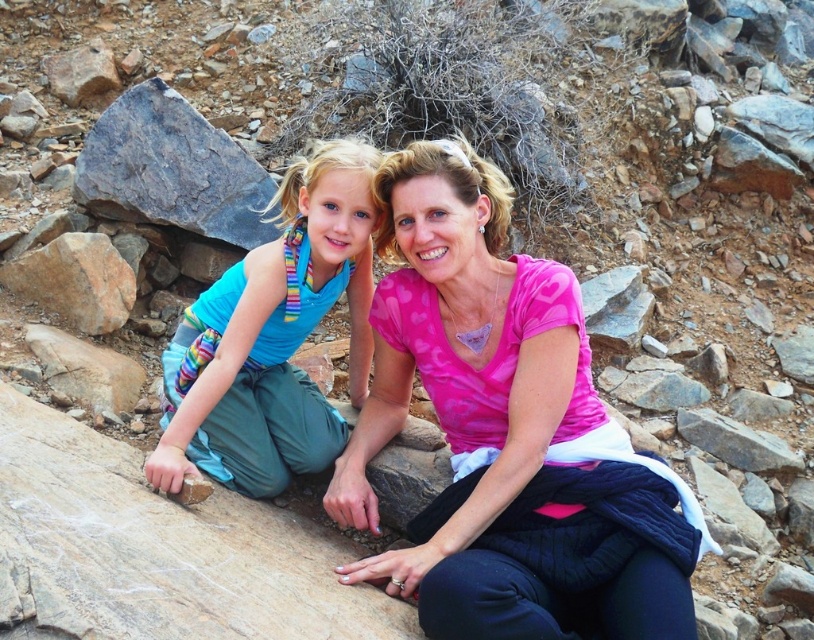
Measure the distance between point [611,621] and camera.

Point [611,621] and camera are 18.04 feet apart from each other.

You are a GUI agent. You are given a task and a screenshot of the screen. Output one action in this format:
    pyautogui.click(x=<x>, y=<y>)
    Task: Click on the pink fabric at center
    The height and width of the screenshot is (640, 814).
    Given the screenshot: What is the action you would take?
    pyautogui.click(x=506, y=433)

Is point (465, 360) less distant than point (228, 420)?

No, it is behind (228, 420).

You are a GUI agent. You are given a task and a screenshot of the screen. Output one action in this format:
    pyautogui.click(x=<x>, y=<y>)
    Task: Click on the pink fabric at center
    The height and width of the screenshot is (640, 814).
    Given the screenshot: What is the action you would take?
    pyautogui.click(x=506, y=433)

Which is in front, point (349, 451) or point (212, 234)?

Point (349, 451) is more forward.

Between point (559, 316) and point (160, 90), which one is positioned behind?

The point (160, 90) is behind.

At what (x,y) coordinates should I click in order to perform the action: click on pink fabric at center. Please return your answer as a coordinate pair (x, y). This screenshot has height=640, width=814. Looking at the image, I should click on (506, 433).

The width and height of the screenshot is (814, 640). I want to click on pink fabric at center, so click(506, 433).

Between blue fabric at center and gray rough boulder at upper left, which one appears on the left side from the viewer's perspective?

Positioned to the left is gray rough boulder at upper left.

You are a GUI agent. You are given a task and a screenshot of the screen. Output one action in this format:
    pyautogui.click(x=<x>, y=<y>)
    Task: Click on the blue fabric at center
    The height and width of the screenshot is (640, 814).
    Given the screenshot: What is the action you would take?
    pyautogui.click(x=274, y=337)

What are the coordinates of `blue fabric at center` in the screenshot? It's located at 274,337.